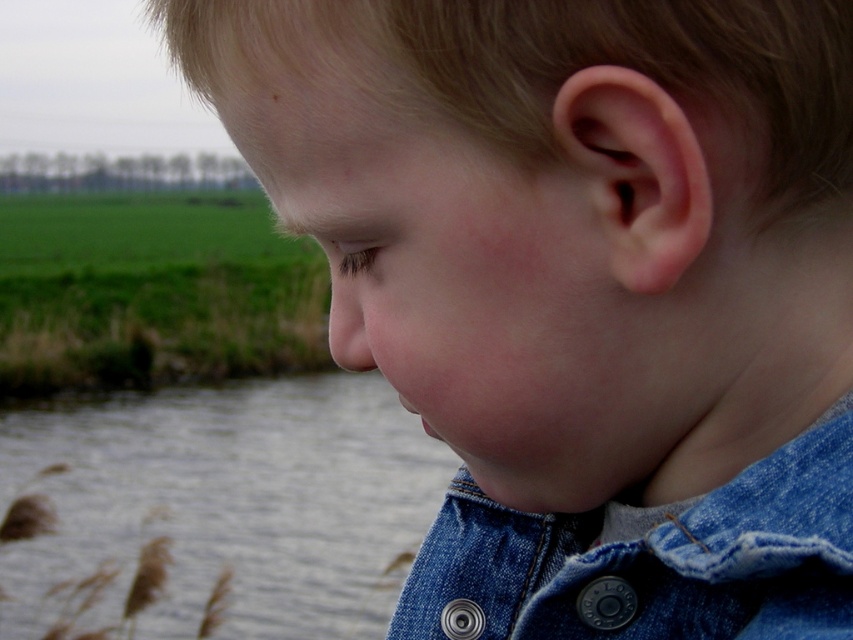
Question: Which of the following is the farthest from the observer?

Choices:
 (A) (474, 604)
 (B) (347, 348)
 (C) (305, 576)

Answer: (C)

Question: Considering the relative positions of gray water at lower left and smooth flesh nose at center in the image provided, where is gray water at lower left located with respect to smooth flesh nose at center?

Choices:
 (A) right
 (B) left

Answer: (B)

Question: Based on their relative distances, which object is nearer to the smooth flesh nose at center?

Choices:
 (A) denim jacket at lower right
 (B) gray water at lower left

Answer: (A)

Question: Based on their relative distances, which object is nearer to the denim jacket at lower right?

Choices:
 (A) smooth flesh nose at center
 (B) gray water at lower left

Answer: (A)

Question: Can you confirm if denim jacket at lower right is smaller than smooth flesh nose at center?

Choices:
 (A) no
 (B) yes

Answer: (A)

Question: Is gray water at lower left thinner than smooth flesh nose at center?

Choices:
 (A) no
 (B) yes

Answer: (A)